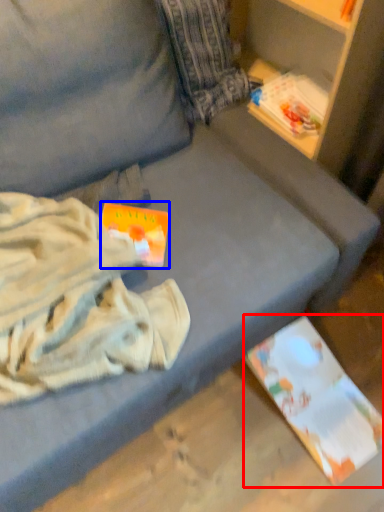
Question: Which object appears closest to the camera in this image, paperback book (highlighted by a red box) or paperback book (highlighted by a blue box)?

Choices:
 (A) paperback book
 (B) paperback book

Answer: (B)